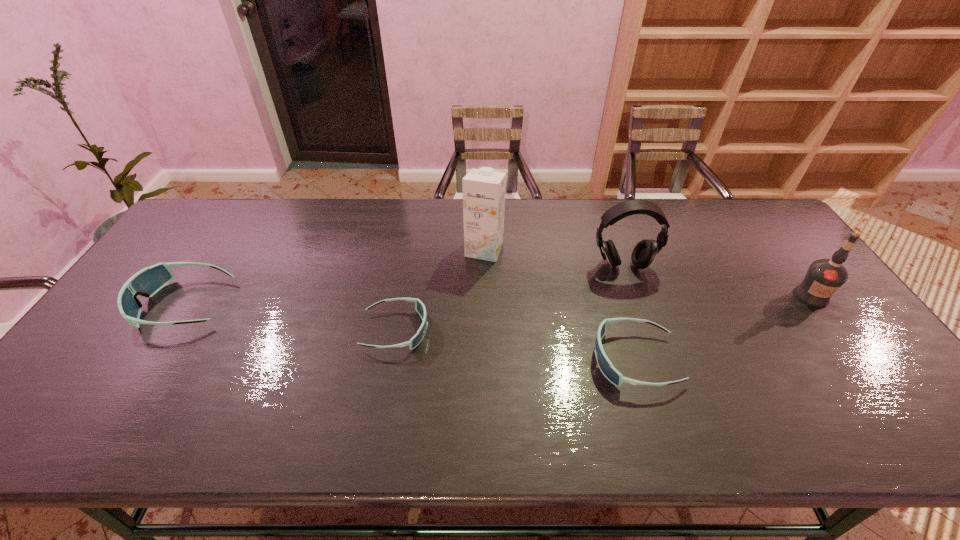
In the image, there is a desktop. Where is `free space at the far edge`? free space at the far edge is located at coordinates (450, 198).

At what (x,y) coordinates should I click in order to perform the action: click on vacant space at the near edge of the desktop. Please return your answer as a coordinate pair (x, y). Looking at the image, I should click on (x=318, y=374).

Where is `free space at the left edge of the desktop`? free space at the left edge of the desktop is located at coordinates (147, 317).

This screenshot has width=960, height=540. Identify the location of vacant space at the far left corner of the desktop. (232, 210).

I want to click on free spot at the far right corner of the desktop, so click(769, 235).

Where is `empty space that is in between the second object from left to right and the earphone`? Image resolution: width=960 pixels, height=540 pixels. empty space that is in between the second object from left to right and the earphone is located at coordinates (509, 298).

Where is `blank region between the shortest object and the earphone`? blank region between the shortest object and the earphone is located at coordinates (509, 298).

Locate an element on the screen. This screenshot has height=540, width=960. free area in between the tallest object and the vodka is located at coordinates (648, 273).

Where is `free space between the vodka and the earphone`? free space between the vodka and the earphone is located at coordinates (717, 281).

The height and width of the screenshot is (540, 960). What are the coordinates of `vacant area that lies between the vodka and the second goggles from left to right` in the screenshot? It's located at (604, 313).